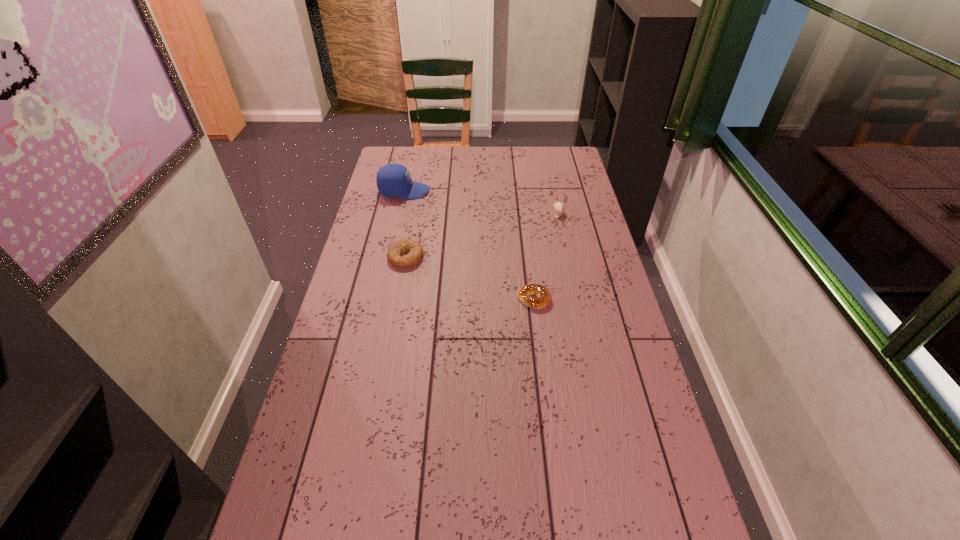
Find the location of `unoccupied position between the left bagel and the second farthest object`. unoccupied position between the left bagel and the second farthest object is located at coordinates (482, 234).

Locate an element on the screen. The image size is (960, 540). vacant area that lies between the third farthest object and the shortest object is located at coordinates (469, 278).

At what (x,y) coordinates should I click in order to perform the action: click on vacant area that lies between the shortest object and the rightmost object. Please return your answer as a coordinate pair (x, y). The height and width of the screenshot is (540, 960). Looking at the image, I should click on (546, 255).

Locate an element on the screen. The image size is (960, 540). free spot between the right bagel and the second shortest object is located at coordinates (469, 278).

The width and height of the screenshot is (960, 540). Find the location of `empty space that is in between the third object from left to right and the cap`. empty space that is in between the third object from left to right and the cap is located at coordinates (468, 245).

The width and height of the screenshot is (960, 540). I want to click on free spot between the left bagel and the cap, so click(405, 224).

What are the coordinates of `free space between the second farthest object and the second nearest object` in the screenshot? It's located at (482, 234).

The width and height of the screenshot is (960, 540). I want to click on free space between the third nearest object and the cap, so click(481, 201).

Where is `empty location between the second shortest object and the third nearest object`? empty location between the second shortest object and the third nearest object is located at coordinates (482, 234).

Identify the location of object identified as the second closest to the third object from left to right. This screenshot has height=540, width=960. (559, 207).